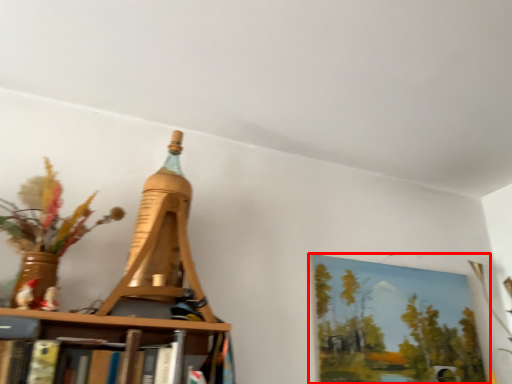
Question: Observing the image, what is the correct spatial positioning of picture frame (annotated by the red box) in reference to Eiffel tower?

Choices:
 (A) right
 (B) left

Answer: (A)